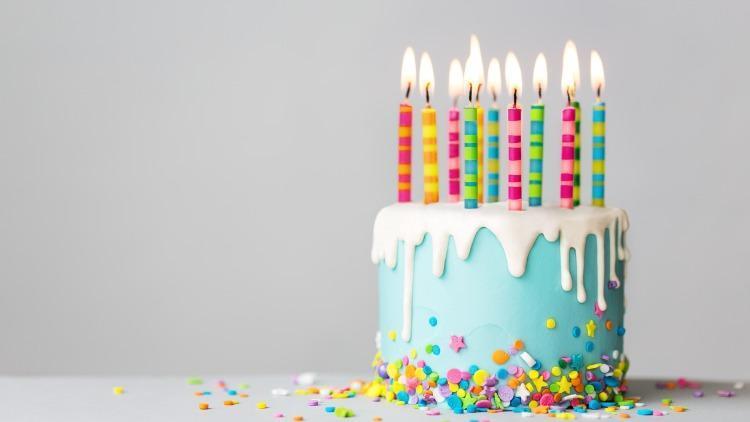
The image size is (750, 422). I want to click on candles, so click(x=606, y=160), click(x=580, y=155), click(x=568, y=173), click(x=536, y=173), click(x=514, y=175), click(x=490, y=170), click(x=477, y=171), click(x=453, y=161), click(x=433, y=161), click(x=406, y=163).